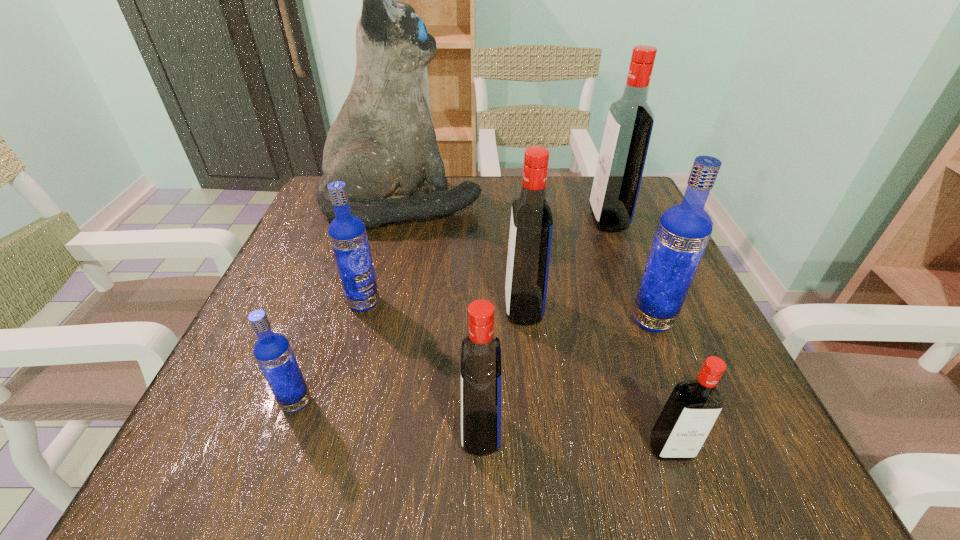
What are the coordinates of `the leftmost vodka` in the screenshot? It's located at [272, 351].

Image resolution: width=960 pixels, height=540 pixels. I want to click on the nearest blue vodka, so click(272, 351).

Locate an element on the screen. Image resolution: width=960 pixels, height=540 pixels. the smallest red vodka is located at coordinates (691, 410).

Find the location of `free space located at the face of the tallest object`. free space located at the face of the tallest object is located at coordinates (561, 204).

Identify the location of free point located 0.140m on the front and back of the farthest red vodka. The height and width of the screenshot is (540, 960). (529, 220).

This screenshot has width=960, height=540. Identify the location of free location located 0.120m on the front and back of the farthest red vodka. (538, 220).

Find the location of a particular element. The width and height of the screenshot is (960, 540). vacant region located 0.350m on the front and back of the farthest red vodka is located at coordinates (436, 220).

Find the location of `free region located 0.260m on the left of the rightmost blue vodka`. free region located 0.260m on the left of the rightmost blue vodka is located at coordinates (481, 320).

Where is `free location located 0.280m on the front and back of the fourth vodka from right to left`? free location located 0.280m on the front and back of the fourth vodka from right to left is located at coordinates (348, 308).

Find the location of a particular element. free spot located 0.240m on the front and back of the fourth vodka from right to left is located at coordinates (371, 308).